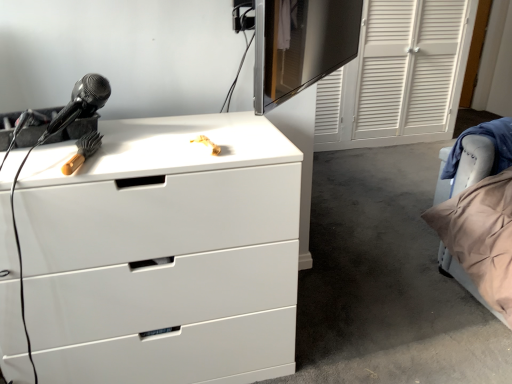
Locate an element on the screen. This screenshot has width=512, height=384. free location in front of velvet beige pillow at right is located at coordinates (453, 300).